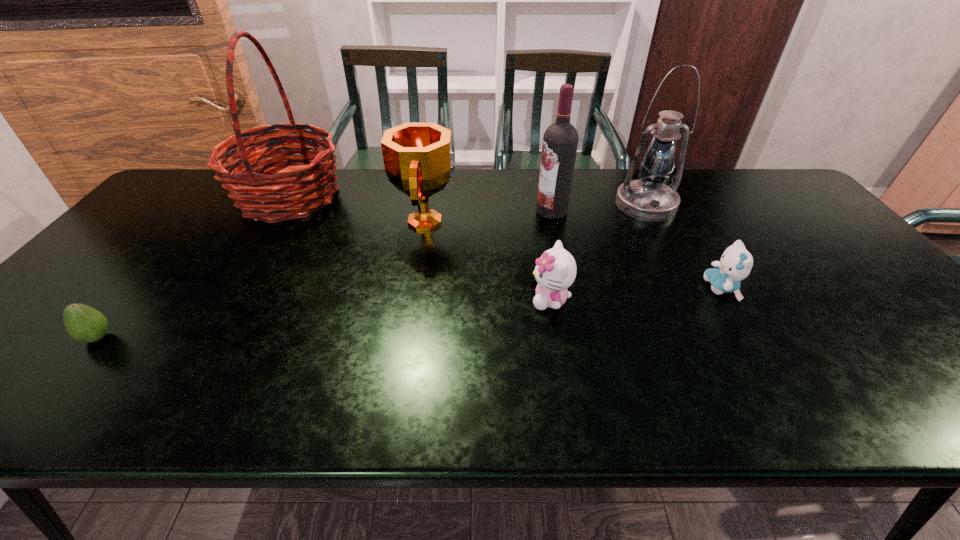
I want to click on free space located on the face of the second shortest object, so click(x=670, y=288).

Locate an element on the screen. The height and width of the screenshot is (540, 960). vacant space located 0.310m on the face of the second shortest object is located at coordinates (582, 288).

You are a GUI agent. You are given a task and a screenshot of the screen. Output one action in this format:
    pyautogui.click(x=<x>, y=<y>)
    Task: Click on the vacant point located on the back of the shortest object
    
    Given the screenshot: What is the action you would take?
    pyautogui.click(x=190, y=227)

Where is `basket that is at the far edge`? Image resolution: width=960 pixels, height=540 pixels. basket that is at the far edge is located at coordinates (304, 188).

Where is `oil lamp situated at the far edge`? This screenshot has height=540, width=960. oil lamp situated at the far edge is located at coordinates (649, 199).

Where is `wine bottle that is at the far edge`? This screenshot has height=540, width=960. wine bottle that is at the far edge is located at coordinates (560, 140).

This screenshot has height=540, width=960. I want to click on award present at the far edge, so click(418, 159).

In order to click on object that is at the left edge in this screenshot , I will do `click(82, 322)`.

In the image, there is a desktop. In order to click on vacant region at the far edge in this screenshot , I will do `click(516, 190)`.

Image resolution: width=960 pixels, height=540 pixels. Find the location of `vacant space at the near edge of the desktop`. vacant space at the near edge of the desktop is located at coordinates (895, 408).